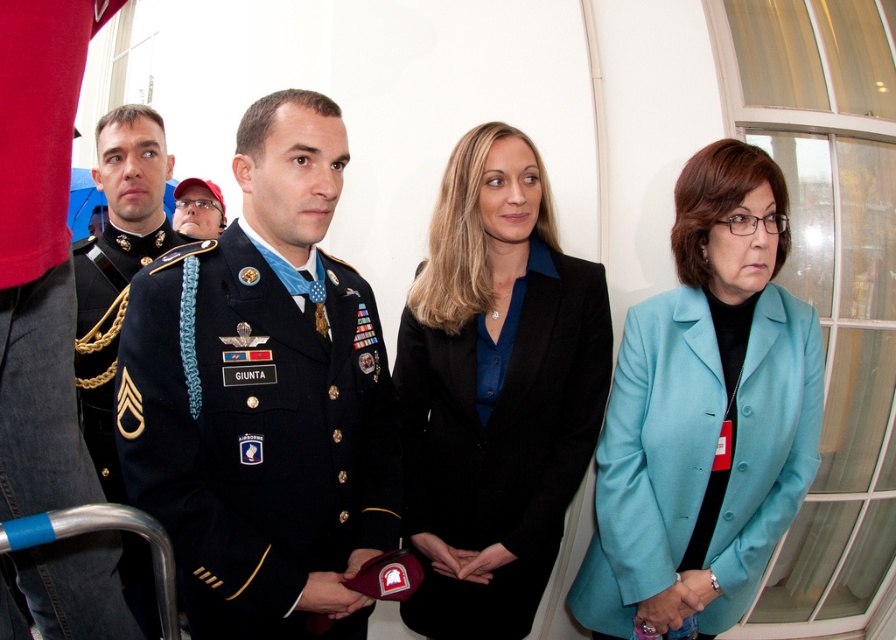
Which is behind, point (317, 544) or point (84, 252)?

Point (84, 252)

Can you confirm if shiny black uniform at center is thinner than shiny black uniform at left?

Incorrect, shiny black uniform at center's width is not less than shiny black uniform at left's.

Between point (277, 426) and point (144, 148), which one is positioned in front?

Positioned in front is point (277, 426).

Identify the location of shiny black uniform at center. The width and height of the screenshot is (896, 640). (263, 396).

Is teal fabric jacket at right to the right of black smooth blazer at center from the viewer's perspective?

Yes, teal fabric jacket at right is to the right of black smooth blazer at center.

What do you see at coordinates (705, 413) in the screenshot? This screenshot has height=640, width=896. I see `teal fabric jacket at right` at bounding box center [705, 413].

This screenshot has height=640, width=896. I want to click on teal fabric jacket at right, so click(x=705, y=413).

Is shiny black uniform at left below matte black cap at upper left?

Correct, shiny black uniform at left is located below matte black cap at upper left.

Can you confirm if shiny black uniform at left is positioned above matte black cap at upper left?

Actually, shiny black uniform at left is below matte black cap at upper left.

Locate an element on the screen. The height and width of the screenshot is (640, 896). shiny black uniform at left is located at coordinates (117, 266).